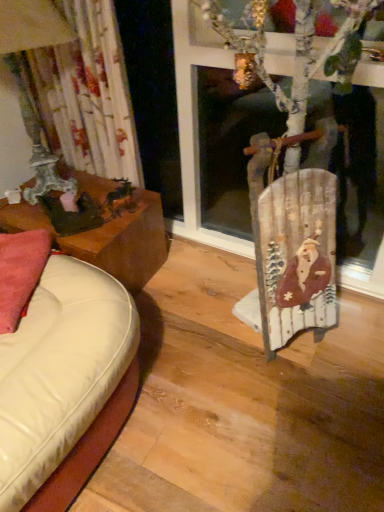
Question: Is the surface of wooden sled at right in direct contact with floral fabric curtain at left?

Choices:
 (A) no
 (B) yes

Answer: (A)

Question: Is wooden sled at right far from floral fabric curtain at left?

Choices:
 (A) no
 (B) yes

Answer: (A)

Question: From a real-world perspective, does wooden sled at right sit lower than floral fabric curtain at left?

Choices:
 (A) yes
 (B) no

Answer: (A)

Question: Is wooden sled at right positioned with its back to floral fabric curtain at left?

Choices:
 (A) no
 (B) yes

Answer: (A)

Question: Is wooden sled at right facing towards floral fabric curtain at left?

Choices:
 (A) yes
 (B) no

Answer: (B)

Question: From their relative heights in the image, would you say wooden sled at right is taller or shorter than pink fabric pillow at left?

Choices:
 (A) tall
 (B) short

Answer: (A)

Question: In terms of width, does wooden sled at right look wider or thinner when compared to pink fabric pillow at left?

Choices:
 (A) wide
 (B) thin

Answer: (A)

Question: Based on their sizes in the image, would you say wooden sled at right is bigger or smaller than pink fabric pillow at left?

Choices:
 (A) small
 (B) big

Answer: (B)

Question: Considering the positions of point (268, 323) and point (1, 268), is point (268, 323) closer or farther from the camera than point (1, 268)?

Choices:
 (A) farther
 (B) closer

Answer: (A)

Question: Would you say brown wooden table at left is to the left or to the right of floral fabric curtain at left in the picture?

Choices:
 (A) right
 (B) left

Answer: (A)

Question: From a real-world perspective, is brown wooden table at left physically located above or below floral fabric curtain at left?

Choices:
 (A) below
 (B) above

Answer: (A)

Question: Considering the positions of point (94, 181) and point (105, 131), is point (94, 181) closer or farther from the camera than point (105, 131)?

Choices:
 (A) closer
 (B) farther

Answer: (B)

Question: Is brown wooden table at left in front of or behind floral fabric curtain at left in the image?

Choices:
 (A) behind
 (B) front

Answer: (A)

Question: Is floral fabric curtain at left taller or shorter than wooden sled at right?

Choices:
 (A) tall
 (B) short

Answer: (B)

Question: From a real-world perspective, is floral fabric curtain at left positioned above or below wooden sled at right?

Choices:
 (A) below
 (B) above

Answer: (B)